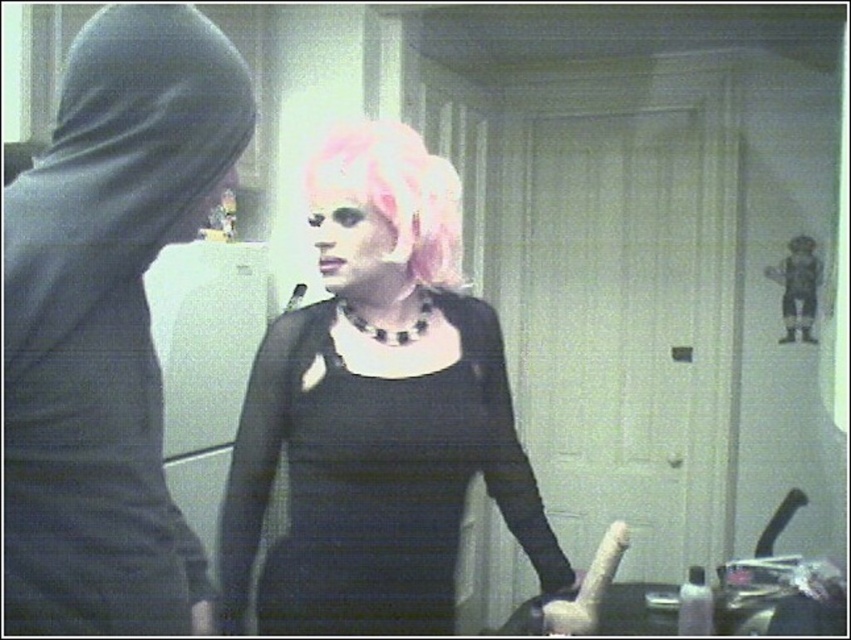
Question: Considering the real-world distances, which object is closest to the matte plastic bottle at lower right?

Choices:
 (A) black matte hoodie at left
 (B) pink synthetic wig at center

Answer: (B)

Question: Is black matte hoodie at left thinner than pink synthetic wig at center?

Choices:
 (A) no
 (B) yes

Answer: (B)

Question: Which of the following is the farthest from the observer?

Choices:
 (A) (423, 484)
 (B) (129, 157)

Answer: (A)

Question: Among these objects, which one is farthest from the camera?

Choices:
 (A) matte black dress at center
 (B) pink synthetic wig at center
 (C) black matte hoodie at left
 (D) matte plastic bottle at lower right

Answer: (D)

Question: Is matte black dress at center thinner than matte plastic bottle at lower right?

Choices:
 (A) yes
 (B) no

Answer: (B)

Question: Is pink synthetic wig at center smaller than matte plastic bottle at lower right?

Choices:
 (A) yes
 (B) no

Answer: (B)